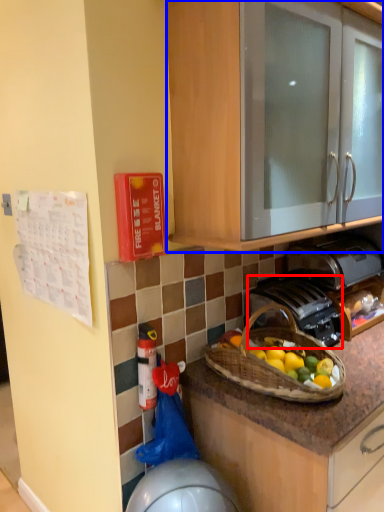
Question: Which point is further to the camera, gas stove (highlighted by a red box) or cabinetry (highlighted by a blue box)?

Choices:
 (A) gas stove
 (B) cabinetry

Answer: (A)